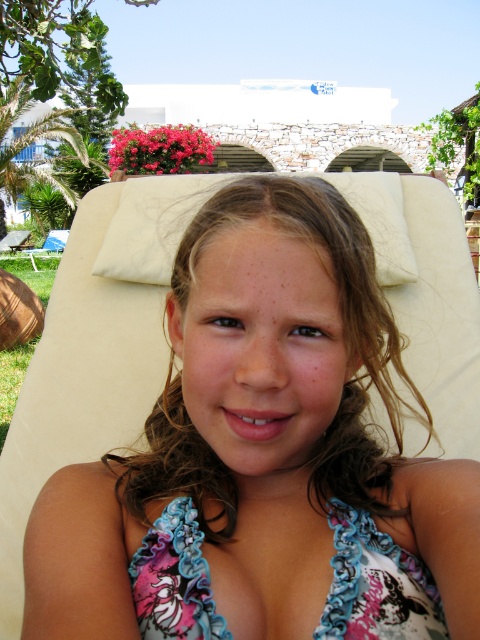
The user is trying to determine which item is positioned to the right in the image. They see both the pink floral swimsuit at center and the floral fabric bikini top at center. Could you clarify which one is located to the right?

The pink floral swimsuit at center is positioned to the right of the floral fabric bikini top at center.